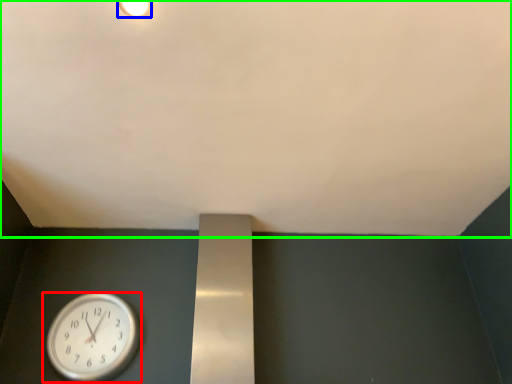
Question: Estimate the real-world distances between objects in this image. Which object is farther from wall clock (highlighted by a red box), light fixture (highlighted by a blue box) or backdrop (highlighted by a green box)?

Choices:
 (A) light fixture
 (B) backdrop

Answer: (A)